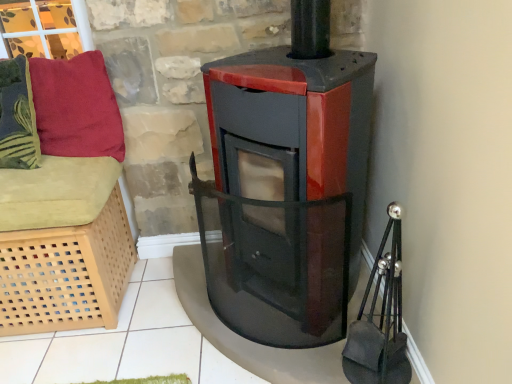
Question: Is velvety red pillow at upper left, the 1th pillow viewed from the right, in front of light wood lattice basket at left?

Choices:
 (A) yes
 (B) no

Answer: (B)

Question: Is light wood lattice basket at left surrounded by velvety red pillow at upper left, the 1th pillow viewed from the right?

Choices:
 (A) yes
 (B) no

Answer: (B)

Question: Can you confirm if velvety red pillow at upper left, the 1th pillow viewed from the right, is smaller than light wood lattice basket at left?

Choices:
 (A) yes
 (B) no

Answer: (A)

Question: From the image's perspective, is velvety red pillow at upper left, the 1th pillow viewed from the right, on top of light wood lattice basket at left?

Choices:
 (A) yes
 (B) no

Answer: (A)

Question: Is velvety red pillow at upper left, which ranks as the second pillow in left-to-right order, oriented towards light wood lattice basket at left?

Choices:
 (A) no
 (B) yes

Answer: (A)

Question: Is velvety red pillow at upper left, the 1th pillow viewed from the right, wider than light wood lattice basket at left?

Choices:
 (A) no
 (B) yes

Answer: (A)

Question: Is light wood lattice basket at left far away from velvety green pillow at left, the 2th pillow when ordered from right to left?

Choices:
 (A) no
 (B) yes

Answer: (A)

Question: Does light wood lattice basket at left turn towards velvety green pillow at left, the 1th pillow when ordered from left to right?

Choices:
 (A) no
 (B) yes

Answer: (A)

Question: Considering the relative sizes of light wood lattice basket at left and velvety green pillow at left, the 2th pillow when ordered from right to left, in the image provided, is light wood lattice basket at left shorter than velvety green pillow at left, the 2th pillow when ordered from right to left,?

Choices:
 (A) no
 (B) yes

Answer: (A)

Question: Does light wood lattice basket at left have a smaller size compared to velvety green pillow at left, the 1th pillow when ordered from left to right?

Choices:
 (A) yes
 (B) no

Answer: (B)

Question: Considering the relative sizes of light wood lattice basket at left and velvety green pillow at left, the 2th pillow when ordered from right to left, in the image provided, is light wood lattice basket at left taller than velvety green pillow at left, the 2th pillow when ordered from right to left,?

Choices:
 (A) no
 (B) yes

Answer: (B)

Question: Is light wood lattice basket at left located outside velvety green pillow at left, the 1th pillow when ordered from left to right?

Choices:
 (A) yes
 (B) no

Answer: (A)

Question: Is velvety red pillow at upper left, the 1th pillow viewed from the right, in contact with velvety green pillow at left, the 2th pillow when ordered from right to left?

Choices:
 (A) no
 (B) yes

Answer: (A)